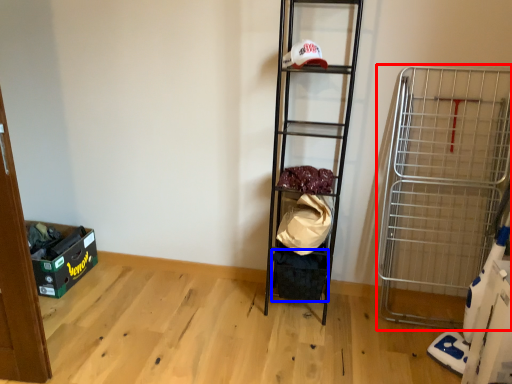
Question: Which object appears closest to the camera in this image, cart (highlighted by a red box) or storage box (highlighted by a blue box)?

Choices:
 (A) cart
 (B) storage box

Answer: (A)